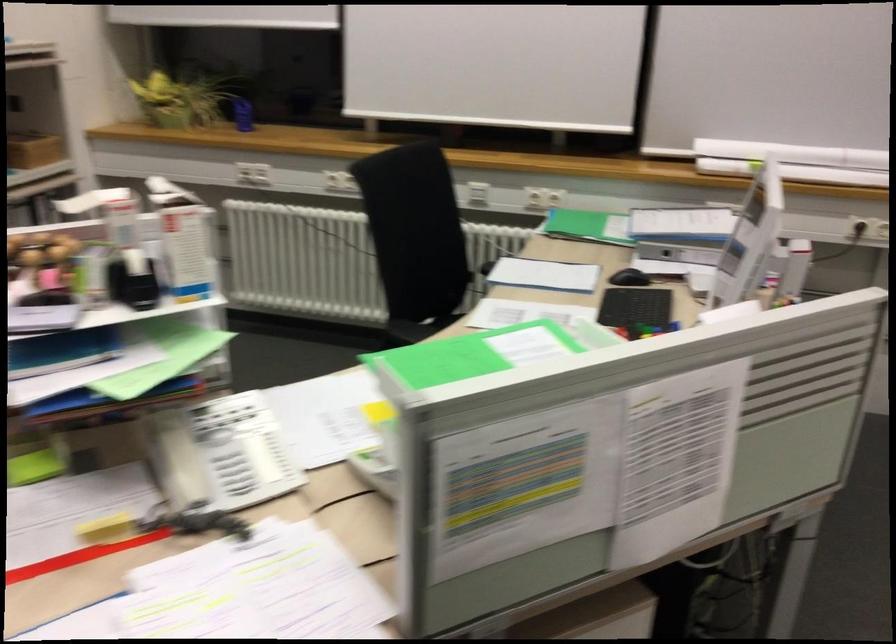
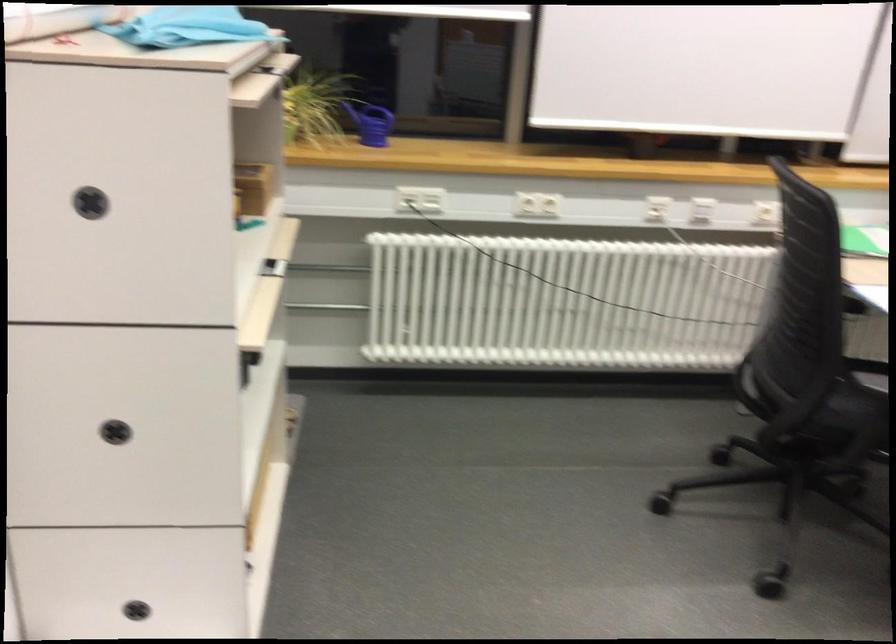
What movement of the cameraman would produce the second image?

The movement direction of the cameraman is left, forward.